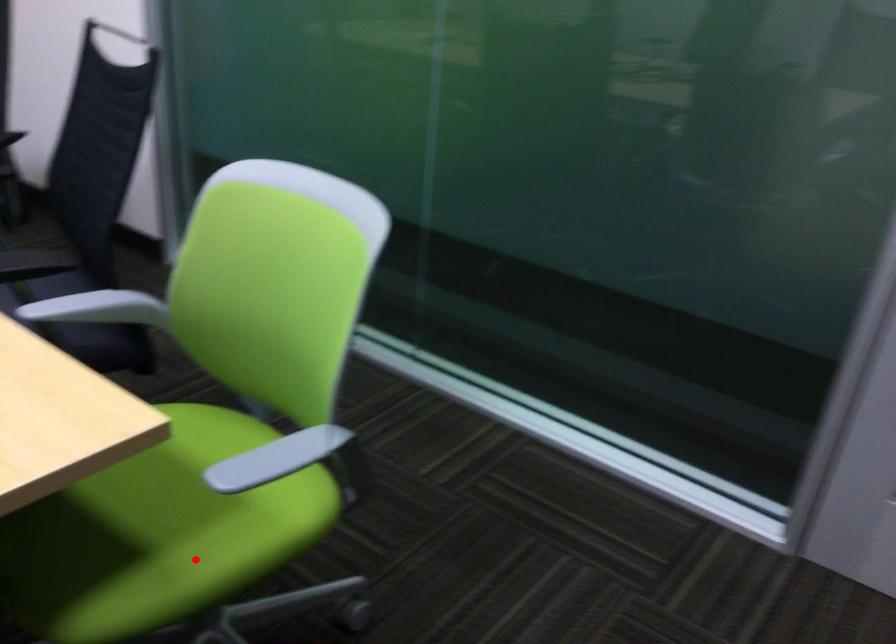
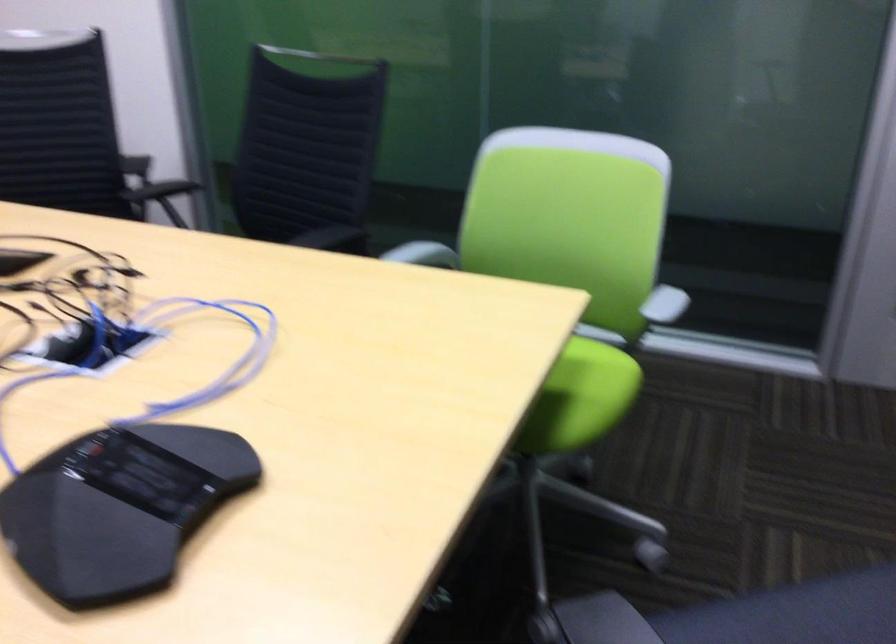
Locate, in the second image, the point that corresponds to the highlighted location in the first image.

(590, 392)